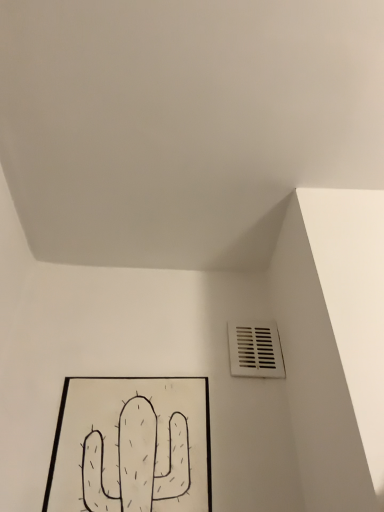
Question: Is white plastic vent at lower right thinner than black paper at lower left?

Choices:
 (A) yes
 (B) no

Answer: (A)

Question: Does white plastic vent at lower right have a smaller size compared to black paper at lower left?

Choices:
 (A) no
 (B) yes

Answer: (B)

Question: Is white plastic vent at lower right positioned beyond the bounds of black paper at lower left?

Choices:
 (A) yes
 (B) no

Answer: (A)

Question: Is white plastic vent at lower right positioned before black paper at lower left?

Choices:
 (A) no
 (B) yes

Answer: (A)

Question: From the image's perspective, is white plastic vent at lower right below black paper at lower left?

Choices:
 (A) yes
 (B) no

Answer: (B)

Question: Is white plastic vent at lower right directly adjacent to black paper at lower left?

Choices:
 (A) yes
 (B) no

Answer: (B)

Question: From the image's perspective, is black paper at lower left above white plastic vent at lower right?

Choices:
 (A) yes
 (B) no

Answer: (B)

Question: Considering the relative sizes of black paper at lower left and white plastic vent at lower right in the image provided, is black paper at lower left shorter than white plastic vent at lower right?

Choices:
 (A) yes
 (B) no

Answer: (B)

Question: Is black paper at lower left outside of white plastic vent at lower right?

Choices:
 (A) no
 (B) yes

Answer: (B)

Question: Is black paper at lower left at the right side of white plastic vent at lower right?

Choices:
 (A) yes
 (B) no

Answer: (B)

Question: Considering the relative positions of black paper at lower left and white plastic vent at lower right in the image provided, is black paper at lower left behind white plastic vent at lower right?

Choices:
 (A) no
 (B) yes

Answer: (A)

Question: Considering the relative sizes of black paper at lower left and white plastic vent at lower right in the image provided, is black paper at lower left bigger than white plastic vent at lower right?

Choices:
 (A) no
 (B) yes

Answer: (B)

Question: Based on their sizes in the image, would you say black paper at lower left is bigger or smaller than white plastic vent at lower right?

Choices:
 (A) big
 (B) small

Answer: (A)